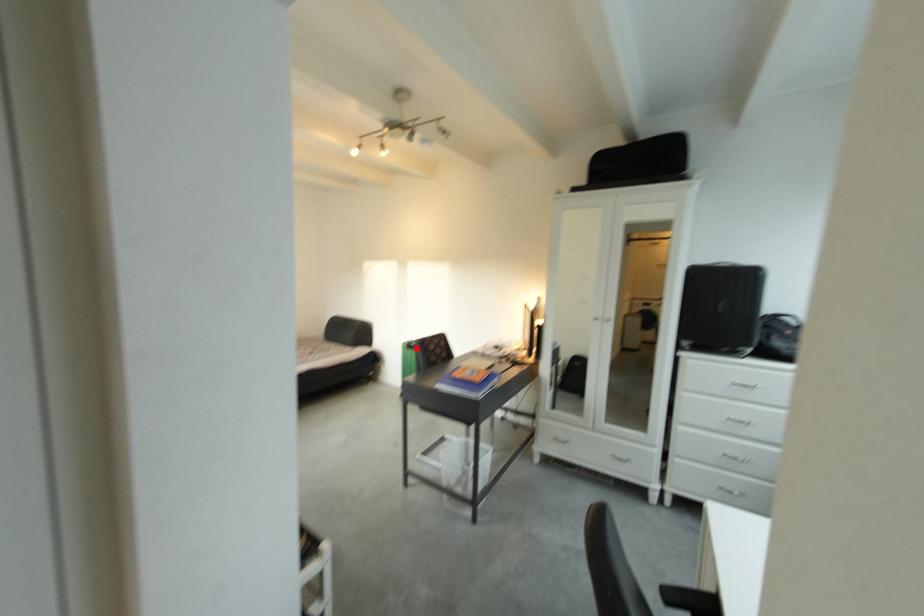
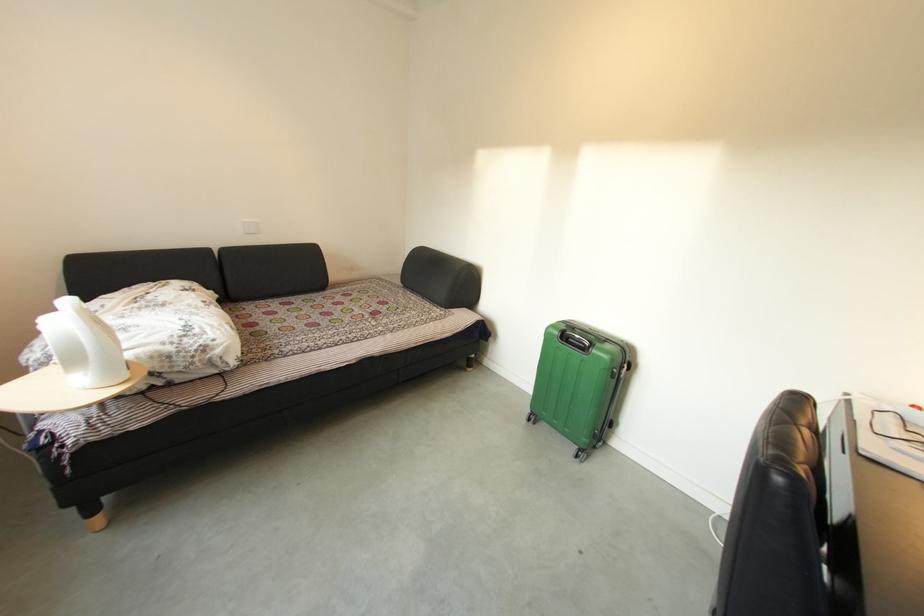
Question: I am providing you with two images of the same scene from different viewpoints. In image1, a red point is highlighted. Considering the same 3D point in image2, which of the following is correct?

Choices:
 (A) It is closer
 (B) It is farther

Answer: (A)